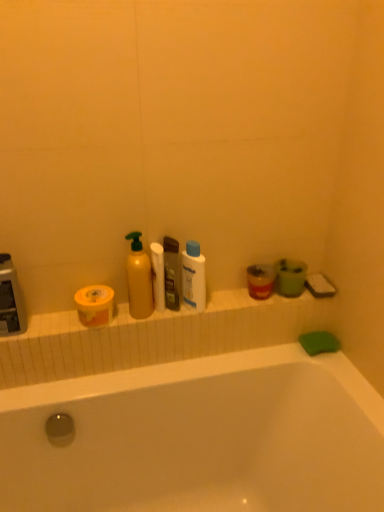
Locate an element on the screen. The height and width of the screenshot is (512, 384). yellow matte toilet paper at left, which appears as the 1th toilet paper when viewed from the left is located at coordinates (95, 305).

Image resolution: width=384 pixels, height=512 pixels. What do you see at coordinates (158, 275) in the screenshot?
I see `white matte toilet paper at center, marked as the 2th toilet paper in a left-to-right arrangement` at bounding box center [158, 275].

You are a GUI agent. You are given a task and a screenshot of the screen. Output one action in this format:
    pyautogui.click(x=<x>, y=<y>)
    Task: Click on the white plastic bottle at center, which is the first cleaning product from right to left
    
    Given the screenshot: What is the action you would take?
    pyautogui.click(x=193, y=276)

How distant is translucent plastic mouthwash at right from yellow matte toilet paper at left, which appears as the 1th toilet paper when viewed from the left?

translucent plastic mouthwash at right is 17.83 inches from yellow matte toilet paper at left, which appears as the 1th toilet paper when viewed from the left.

Considering the relative positions of translucent plastic mouthwash at right and yellow matte toilet paper at left, which appears as the 1th toilet paper when viewed from the left, in the image provided, is translucent plastic mouthwash at right to the left or to the right of yellow matte toilet paper at left, which appears as the 1th toilet paper when viewed from the left,?

From the image, it's evident that translucent plastic mouthwash at right is to the right of yellow matte toilet paper at left, which appears as the 1th toilet paper when viewed from the left.

Consider the image. Which is in front, translucent plastic mouthwash at right or yellow matte toilet paper at left, marked as the second toilet paper in a right-to-left arrangement?

yellow matte toilet paper at left, marked as the second toilet paper in a right-to-left arrangement, is closer to the camera.

You are a GUI agent. You are given a task and a screenshot of the screen. Output one action in this format:
    pyautogui.click(x=<x>, y=<y>)
    Task: Click on the 2nd toilet paper counting from the left side of the translucent plastic mouthwash at right
    
    Given the screenshot: What is the action you would take?
    pyautogui.click(x=95, y=305)

Does white plastic bottle at center, which is the first cleaning product from right to left, have a lesser height compared to translucent plastic mouthwash at right?

In fact, white plastic bottle at center, which is the first cleaning product from right to left, may be taller than translucent plastic mouthwash at right.

Can you confirm if white plastic bottle at center, positioned as the 2th cleaning product in left-to-right order, is wider than translucent plastic mouthwash at right?

Incorrect, the width of white plastic bottle at center, positioned as the 2th cleaning product in left-to-right order, does not surpass that of translucent plastic mouthwash at right.

Who is more distant, white plastic bottle at center, which is the first cleaning product from right to left, or translucent plastic mouthwash at right?

translucent plastic mouthwash at right is behind.

Is translucent plastic soap dispenser at center facing towards yellow matte toilet paper at left, marked as the second toilet paper in a right-to-left arrangement?

No.

From the image's perspective, relative to yellow matte toilet paper at left, which appears as the 1th toilet paper when viewed from the left, is translucent plastic soap dispenser at center above or below?

translucent plastic soap dispenser at center is above yellow matte toilet paper at left, which appears as the 1th toilet paper when viewed from the left.

From a real-world perspective, who is located higher, translucent plastic soap dispenser at center or yellow matte toilet paper at left, marked as the second toilet paper in a right-to-left arrangement?

From a 3D spatial view, translucent plastic soap dispenser at center is above.

You are a GUI agent. You are given a task and a screenshot of the screen. Output one action in this format:
    pyautogui.click(x=<x>, y=<y>)
    Task: Click on the 2nd toilet paper in front of the translucent plastic soap dispenser at center
    
    Given the screenshot: What is the action you would take?
    pyautogui.click(x=95, y=305)

Choose the correct answer: Is translucent plastic mouthwash at right inside white matte toilet paper at center, marked as the 2th toilet paper in a left-to-right arrangement, or outside it?

translucent plastic mouthwash at right lies outside white matte toilet paper at center, marked as the 2th toilet paper in a left-to-right arrangement.

How much distance is there between translucent plastic mouthwash at right and white matte toilet paper at center, marked as the 2th toilet paper in a left-to-right arrangement?

translucent plastic mouthwash at right is 11.49 inches from white matte toilet paper at center, marked as the 2th toilet paper in a left-to-right arrangement.

Is translucent plastic mouthwash at right to the left or to the right of white matte toilet paper at center, which is the first toilet paper in right-to-left order, in the image?

In the image, translucent plastic mouthwash at right appears on the right side of white matte toilet paper at center, which is the first toilet paper in right-to-left order.

Is translucent plastic mouthwash at right oriented towards white matte toilet paper at center, marked as the 2th toilet paper in a left-to-right arrangement?

No, translucent plastic mouthwash at right is not aimed at white matte toilet paper at center, marked as the 2th toilet paper in a left-to-right arrangement.

How distant is yellow matte bottle at center, the 1th cleaning product from the left, from translucent plastic soap dispenser at center?

The distance of yellow matte bottle at center, the 1th cleaning product from the left, from translucent plastic soap dispenser at center is 3.47 inches.

Locate an element on the screen. The image size is (384, 512). the 2nd cleaning product in front of the translucent plastic soap dispenser at center is located at coordinates tap(139, 279).

Is yellow matte bottle at center, which appears as the second cleaning product when viewed from the right, spatially inside translucent plastic soap dispenser at center, or outside of it?

yellow matte bottle at center, which appears as the second cleaning product when viewed from the right, is not inside translucent plastic soap dispenser at center, it's outside.

From the image's perspective, between yellow matte bottle at center, which appears as the second cleaning product when viewed from the right, and translucent plastic soap dispenser at center, which one is located above?

yellow matte bottle at center, which appears as the second cleaning product when viewed from the right, from the image's perspective.

From the image's perspective, would you say white plastic bottle at center, positioned as the 2th cleaning product in left-to-right order, is shown under yellow matte toilet paper at left, which appears as the 1th toilet paper when viewed from the left?

No.

Is white plastic bottle at center, positioned as the 2th cleaning product in left-to-right order, to the left or to the right of yellow matte toilet paper at left, marked as the second toilet paper in a right-to-left arrangement, in the image?

Based on their positions, white plastic bottle at center, positioned as the 2th cleaning product in left-to-right order, is located to the right of yellow matte toilet paper at left, marked as the second toilet paper in a right-to-left arrangement.

How far apart are white plastic bottle at center, which is the first cleaning product from right to left, and yellow matte toilet paper at left, marked as the second toilet paper in a right-to-left arrangement?

white plastic bottle at center, which is the first cleaning product from right to left, and yellow matte toilet paper at left, marked as the second toilet paper in a right-to-left arrangement, are 9.82 inches apart from each other.

Can you confirm if white plastic bottle at center, positioned as the 2th cleaning product in left-to-right order, is wider than yellow matte toilet paper at left, which appears as the 1th toilet paper when viewed from the left?

Incorrect, the width of white plastic bottle at center, positioned as the 2th cleaning product in left-to-right order, does not surpass that of yellow matte toilet paper at left, which appears as the 1th toilet paper when viewed from the left.

From a real-world perspective, is white plastic bottle at center, which is the first cleaning product from right to left, on top of yellow matte bottle at center, the 1th cleaning product from the left?

No, from a real-world perspective, white plastic bottle at center, which is the first cleaning product from right to left, is not on top of yellow matte bottle at center, the 1th cleaning product from the left.

Considering the relative sizes of white plastic bottle at center, which is the first cleaning product from right to left, and yellow matte bottle at center, which appears as the second cleaning product when viewed from the right, in the image provided, is white plastic bottle at center, which is the first cleaning product from right to left, shorter than yellow matte bottle at center, which appears as the second cleaning product when viewed from the right,?

Indeed, white plastic bottle at center, which is the first cleaning product from right to left, has a lesser height compared to yellow matte bottle at center, which appears as the second cleaning product when viewed from the right.

Is white plastic bottle at center, which is the first cleaning product from right to left, outside of yellow matte bottle at center, which appears as the second cleaning product when viewed from the right?

Yes, white plastic bottle at center, which is the first cleaning product from right to left, is outside of yellow matte bottle at center, which appears as the second cleaning product when viewed from the right.

The image size is (384, 512). Identify the location of mouthwash located on the right of yellow matte toilet paper at left, marked as the second toilet paper in a right-to-left arrangement. (260, 280).

You are a GUI agent. You are given a task and a screenshot of the screen. Output one action in this format:
    pyautogui.click(x=<x>, y=<y>)
    Task: Click on the cleaning product that is the 1st one when counting forward from the translucent plastic mouthwash at right
    
    Given the screenshot: What is the action you would take?
    pyautogui.click(x=193, y=276)

Estimate the real-world distances between objects in this image. Which object is further from translucent plastic mouthwash at right, translucent plastic soap dispenser at center or white matte toilet paper at center, which is the first toilet paper in right-to-left order?

white matte toilet paper at center, which is the first toilet paper in right-to-left order, is positioned further to the anchor translucent plastic mouthwash at right.

From the image, which object appears to be nearer to white plastic bottle at center, positioned as the 2th cleaning product in left-to-right order, yellow matte toilet paper at left, marked as the second toilet paper in a right-to-left arrangement, or translucent plastic soap dispenser at center?

translucent plastic soap dispenser at center is positioned closer to the anchor white plastic bottle at center, positioned as the 2th cleaning product in left-to-right order.

Estimate the real-world distances between objects in this image. Which object is further from translucent plastic mouthwash at right, white matte toilet paper at center, marked as the 2th toilet paper in a left-to-right arrangement, or white plastic bottle at center, which is the first cleaning product from right to left?

white matte toilet paper at center, marked as the 2th toilet paper in a left-to-right arrangement, is further to translucent plastic mouthwash at right.

Which object lies further to the anchor point translucent plastic mouthwash at right, translucent plastic soap dispenser at center or yellow matte toilet paper at left, marked as the second toilet paper in a right-to-left arrangement?

yellow matte toilet paper at left, marked as the second toilet paper in a right-to-left arrangement, is positioned further to the anchor translucent plastic mouthwash at right.

Estimate the real-world distances between objects in this image. Which object is closer to yellow matte toilet paper at left, which appears as the 1th toilet paper when viewed from the left, translucent plastic soap dispenser at center or white plastic bottle at center, positioned as the 2th cleaning product in left-to-right order?

The object closer to yellow matte toilet paper at left, which appears as the 1th toilet paper when viewed from the left, is translucent plastic soap dispenser at center.

From the picture: Which object lies nearer to the anchor point translucent plastic mouthwash at right, yellow matte bottle at center, the 1th cleaning product from the left, or translucent plastic soap dispenser at center?

translucent plastic soap dispenser at center.

Looking at the image, which one is located further to white matte toilet paper at center, marked as the 2th toilet paper in a left-to-right arrangement, yellow matte bottle at center, the 1th cleaning product from the left, or yellow matte toilet paper at left, which appears as the 1th toilet paper when viewed from the left?

yellow matte toilet paper at left, which appears as the 1th toilet paper when viewed from the left.

Which object lies further to the anchor point translucent plastic mouthwash at right, white matte toilet paper at center, which is the first toilet paper in right-to-left order, or yellow matte bottle at center, which appears as the second cleaning product when viewed from the right?

yellow matte bottle at center, which appears as the second cleaning product when viewed from the right, is further to translucent plastic mouthwash at right.

Locate an element on the screen. Image resolution: width=384 pixels, height=512 pixels. toilet paper located between yellow matte bottle at center, which appears as the second cleaning product when viewed from the right, and translucent plastic mouthwash at right in the left-right direction is located at coordinates (158, 275).

What are the coordinates of `toiletry between yellow matte bottle at center, which appears as the second cleaning product when viewed from the right, and white plastic bottle at center, positioned as the 2th cleaning product in left-to-right order, in the horizontal direction` in the screenshot? It's located at (171, 273).

Find the location of a particular element. cleaning product between yellow matte toilet paper at left, which appears as the 1th toilet paper when viewed from the left, and translucent plastic soap dispenser at center is located at coordinates (139, 279).

I want to click on cleaning product located between yellow matte bottle at center, the 1th cleaning product from the left, and translucent plastic mouthwash at right in the left-right direction, so click(x=193, y=276).